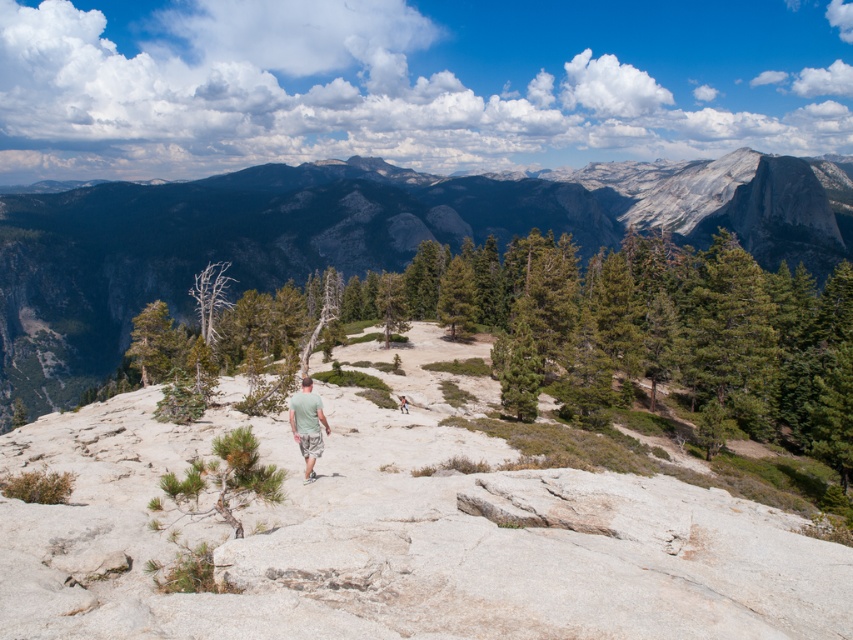
Can you confirm if gray rock at center is shorter than green cotton shirt at center?

Incorrect, gray rock at center's height does not fall short of green cotton shirt at center's.

Between gray rock at center and green cotton shirt at center, which one is positioned lower?

Positioned lower is gray rock at center.

This screenshot has width=853, height=640. What do you see at coordinates (393, 532) in the screenshot? I see `gray rock at center` at bounding box center [393, 532].

The image size is (853, 640). Find the location of `gray rock at center`. gray rock at center is located at coordinates (393, 532).

Which is in front, point (251, 508) or point (399, 401)?

Point (251, 508)

Does gray rock at center appear on the right side of green fabric shirt at center?

Answer: Incorrect, gray rock at center is not on the right side of green fabric shirt at center.

Between point (691, 563) and point (399, 401), which one is positioned in front?

Point (691, 563) is more forward.

Locate an element on the screen. Image resolution: width=853 pixels, height=640 pixels. gray rock at center is located at coordinates (393, 532).

From the picture: Is gray rock at center below gray rock formation at center?

Indeed, gray rock at center is positioned under gray rock formation at center.

What do you see at coordinates (393, 532) in the screenshot? Image resolution: width=853 pixels, height=640 pixels. I see `gray rock at center` at bounding box center [393, 532].

Locate an element on the screen. The image size is (853, 640). gray rock at center is located at coordinates (393, 532).